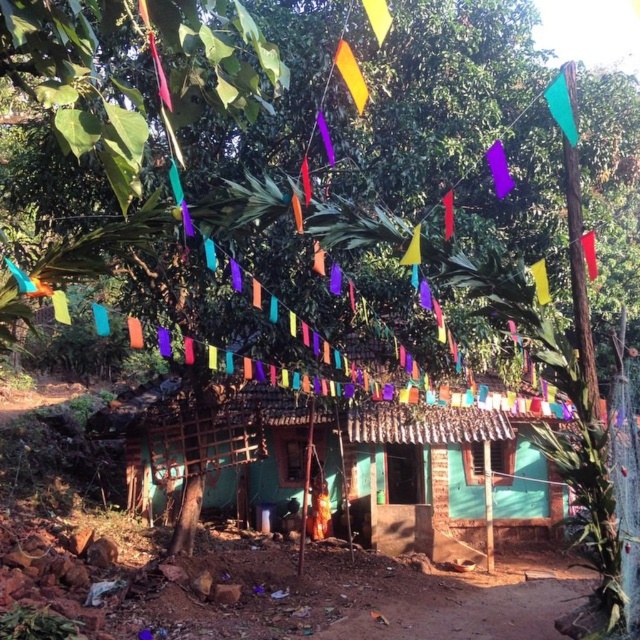
Does purple fabric flag at upper right have a smaller size compared to orange fabric flag at upper center?

Incorrect, purple fabric flag at upper right is not smaller in size than orange fabric flag at upper center.

Which is in front, point (497, 141) or point (301, 179)?

Point (301, 179) is in front.

Is point (492, 173) positioned before point (307, 200)?

No, (492, 173) is further to viewer.

I want to click on purple fabric flag at upper right, so [499, 168].

I want to click on matte blue flag at upper left, so click(20, 276).

Is matte blue flag at upper left positioned behind purple fabric flag at center?

No, it is not.

Measure the distance between matte blue flag at upper left and camera.

matte blue flag at upper left is 11.44 feet from camera.

Identify the location of matte blue flag at upper left. (20, 276).

Who is positioned more to the right, green fabric flag at upper right or purple fabric flag at upper right?

green fabric flag at upper right is more to the right.

Is green fabric flag at upper right bigger than purple fabric flag at upper right?

No.

Identify the location of green fabric flag at upper right. This screenshot has height=640, width=640. (561, 108).

The height and width of the screenshot is (640, 640). I want to click on green fabric flag at upper right, so click(561, 108).